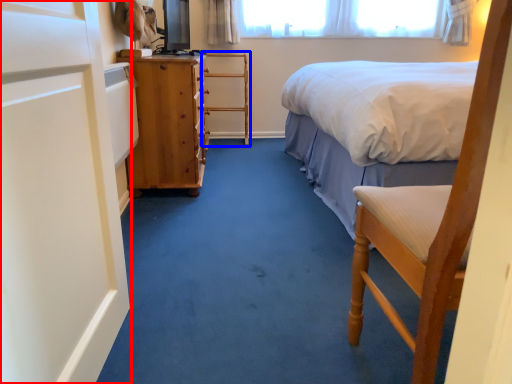
Question: Among these objects, which one is nearest to the camera, screen door (highlighted by a red box) or armchair (highlighted by a blue box)?

Choices:
 (A) screen door
 (B) armchair

Answer: (A)